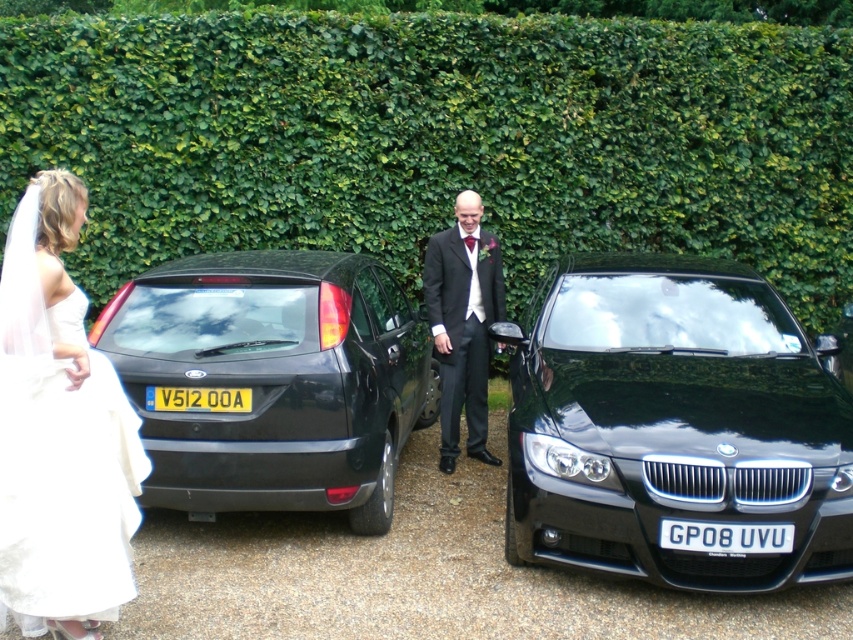
Which of these two, green leafy hedge at upper center or shiny black hatchback at center, stands shorter?

shiny black hatchback at center is shorter.

Where is `green leafy hedge at upper center`? green leafy hedge at upper center is located at coordinates (439, 138).

Which is above, matte black suit at center or yellowmaterial/texturelicense plate at center?

matte black suit at center is above.

Who is more distant from viewer, (480, 332) or (144, 394)?

Positioned behind is point (480, 332).

Is point (434, 248) positioned in front of point (238, 397)?

No.

Where is `matte black suit at center`? The height and width of the screenshot is (640, 853). matte black suit at center is located at coordinates (463, 323).

Does white satin dress at left appear on the right side of white plastic license plate at center?

In fact, white satin dress at left is to the left of white plastic license plate at center.

Identify the location of white satin dress at left. The height and width of the screenshot is (640, 853). (61, 429).

Is point (45, 611) positioned before point (675, 545)?

That is True.

This screenshot has height=640, width=853. I want to click on white satin dress at left, so click(x=61, y=429).